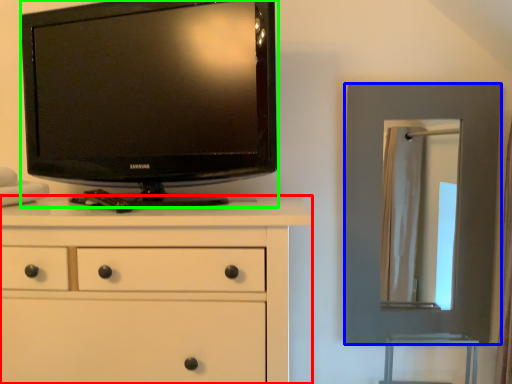
Question: Estimate the real-world distances between objects in this image. Which object is closer to chest of drawers (highlighted by a red box), picture frame (highlighted by a blue box) or television (highlighted by a green box)?

Choices:
 (A) picture frame
 (B) television

Answer: (B)